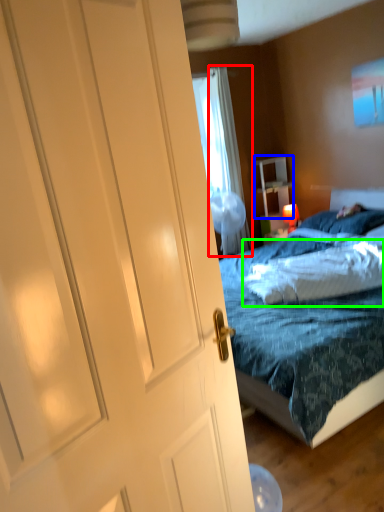
Question: Which object is the farthest from curtain (highlighted by a red box)? Choose among these: nightstand (highlighted by a blue box) or pillow (highlighted by a green box).

Choices:
 (A) nightstand
 (B) pillow

Answer: (B)